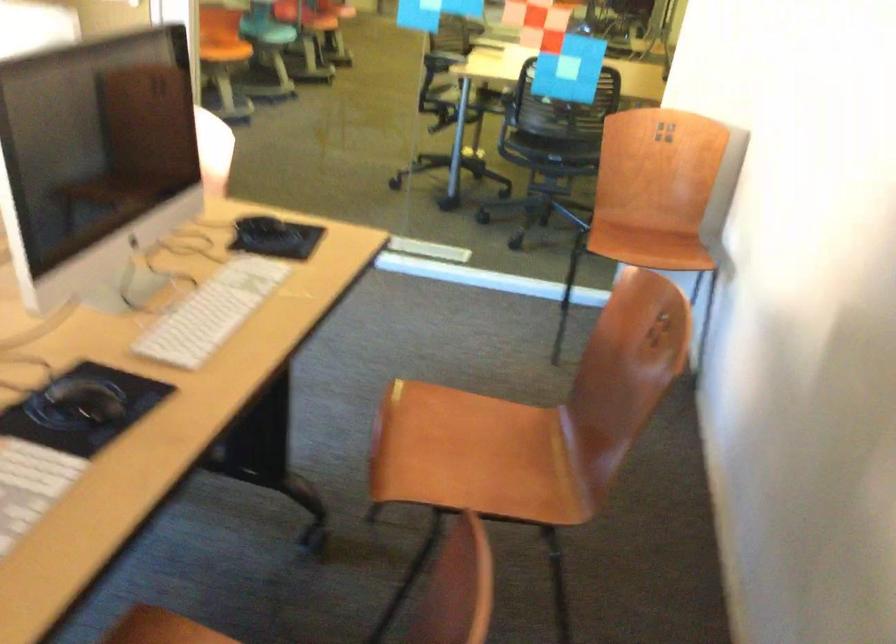
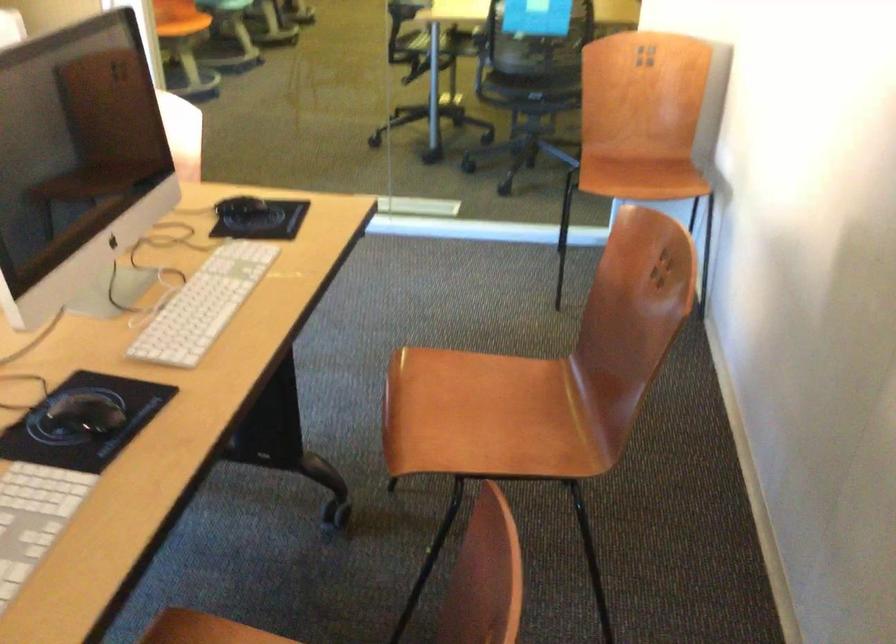
Question: Which direction would the cameraman need to move to produce the second image? Reply with the corresponding letter.

Choices:
 (A) Left
 (B) Right
 (C) Forward
 (D) Backward

Answer: (C)